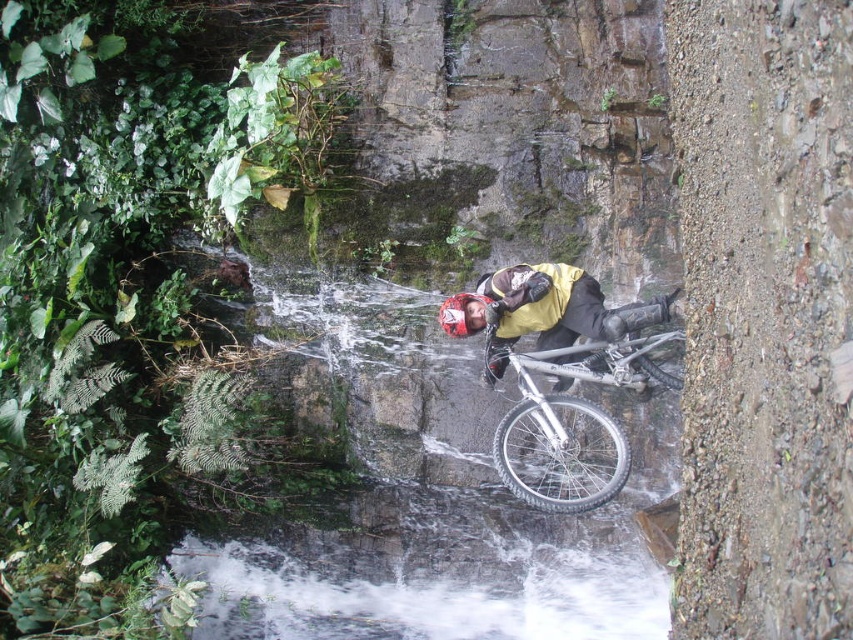
Question: Can you confirm if silver metallic mountain bike at center is bigger than yellow matte jacket at center?

Choices:
 (A) yes
 (B) no

Answer: (A)

Question: Which of the following is the closest to the observer?

Choices:
 (A) yellow matte jacket at center
 (B) silver metallic mountain bike at center

Answer: (B)

Question: Is silver metallic mountain bike at center bigger than yellow matte jacket at center?

Choices:
 (A) no
 (B) yes

Answer: (B)

Question: Among these objects, which one is farthest from the camera?

Choices:
 (A) silver metallic mountain bike at center
 (B) yellow matte jacket at center

Answer: (B)

Question: In this image, where is silver metallic mountain bike at center located relative to yellow matte jacket at center?

Choices:
 (A) above
 (B) below

Answer: (B)

Question: Among these objects, which one is nearest to the camera?

Choices:
 (A) yellow matte jacket at center
 (B) silver metallic mountain bike at center

Answer: (B)